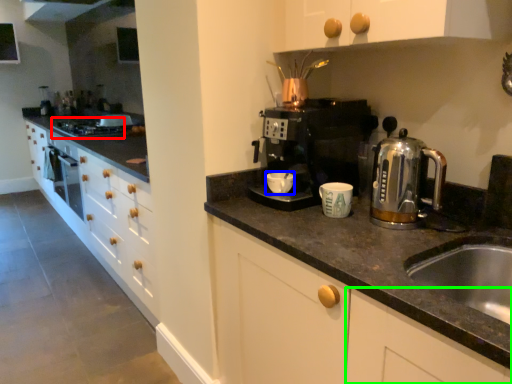
Question: Based on their relative distances, which object is nearer to gas stove (highlighted by a red box)? Choose from mug (highlighted by a blue box) and cabinetry (highlighted by a green box).

Choices:
 (A) mug
 (B) cabinetry

Answer: (A)